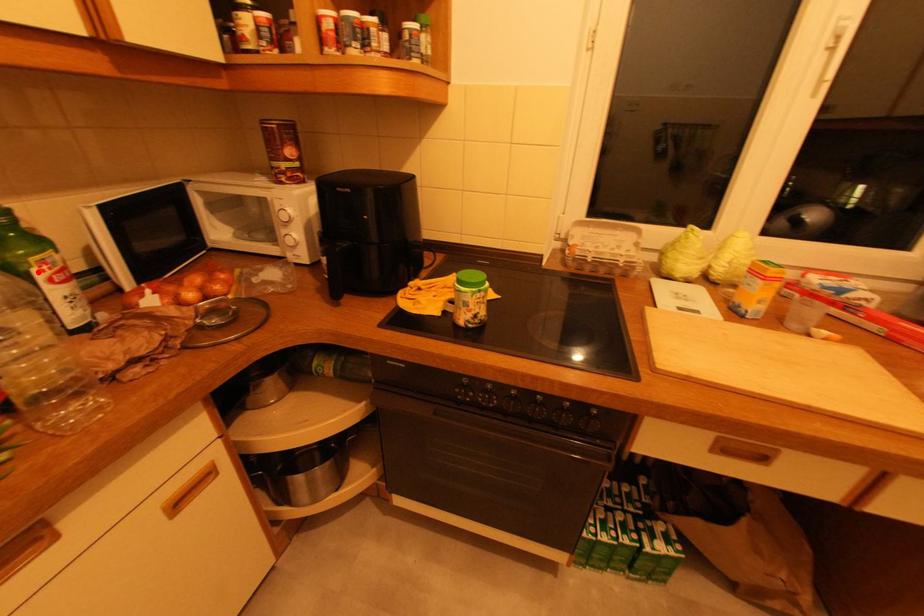
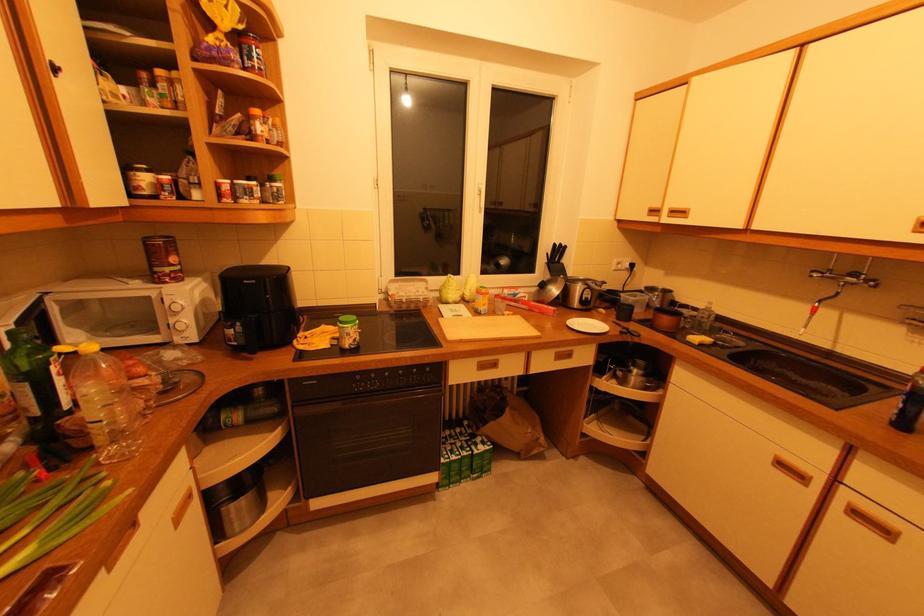
Question: I am providing you with two images of the same scene from different viewpoints. A red point is marked on the first image. Is the red point's position out of view in image 2?

Choices:
 (A) Yes
 (B) No

Answer: (B)